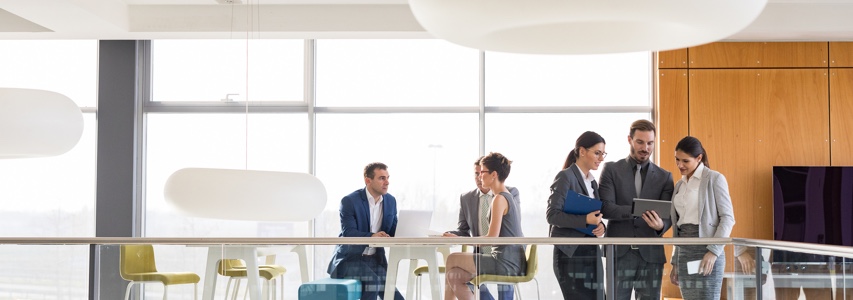
Where is `window`? The height and width of the screenshot is (300, 853). window is located at coordinates (273, 133), (264, 84), (398, 84), (413, 132), (526, 141), (559, 78), (74, 174), (68, 68).